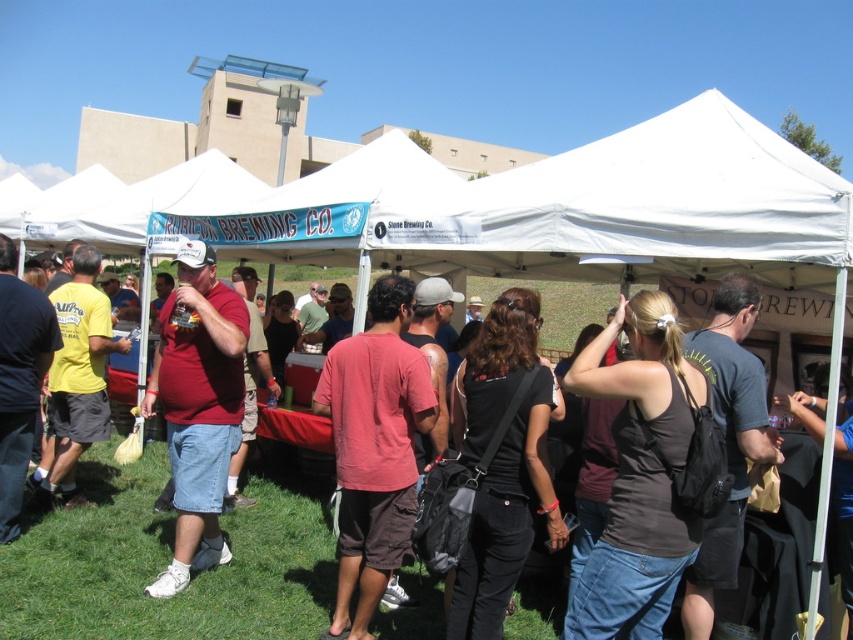
Can you confirm if brown cotton shirt at center is wider than matte red shirt at center?

In fact, brown cotton shirt at center might be narrower than matte red shirt at center.

Can you confirm if brown cotton shirt at center is positioned below matte red shirt at center?

Yes, brown cotton shirt at center is below matte red shirt at center.

Between point (408, 499) and point (209, 372), which one is positioned behind?

The point (209, 372) is behind.

This screenshot has width=853, height=640. Find the location of `brown cotton shirt at center`. brown cotton shirt at center is located at coordinates (374, 449).

Is black matte tank top at center closer to the viewer compared to brown cotton shirt at center?

Yes, it is.

Between point (630, 525) and point (410, 392), which one is positioned behind?

Positioned behind is point (410, 392).

Is point (624, 547) in front of point (409, 536)?

Yes, point (624, 547) is in front of point (409, 536).

Where is `black matte tank top at center`? This screenshot has height=640, width=853. black matte tank top at center is located at coordinates (637, 474).

Which is more to the left, black matte tank top at center or matte red shirt at center?

matte red shirt at center is more to the left.

Between point (686, 404) and point (141, 410), which one is positioned behind?

The point (141, 410) is more distant.

The image size is (853, 640). What are the coordinates of `black matte tank top at center` in the screenshot? It's located at (637, 474).